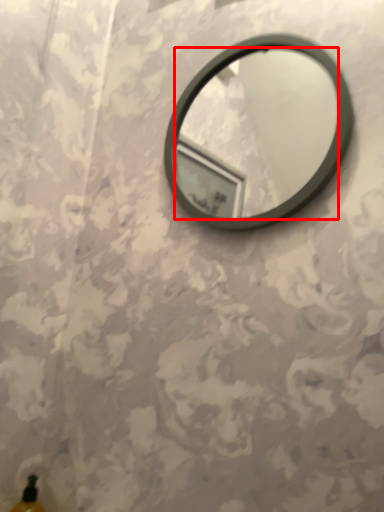
Question: From the image's perspective, what is the correct spatial positioning of mirror (annotated by the red box) in reference to bottle?

Choices:
 (A) above
 (B) below

Answer: (A)